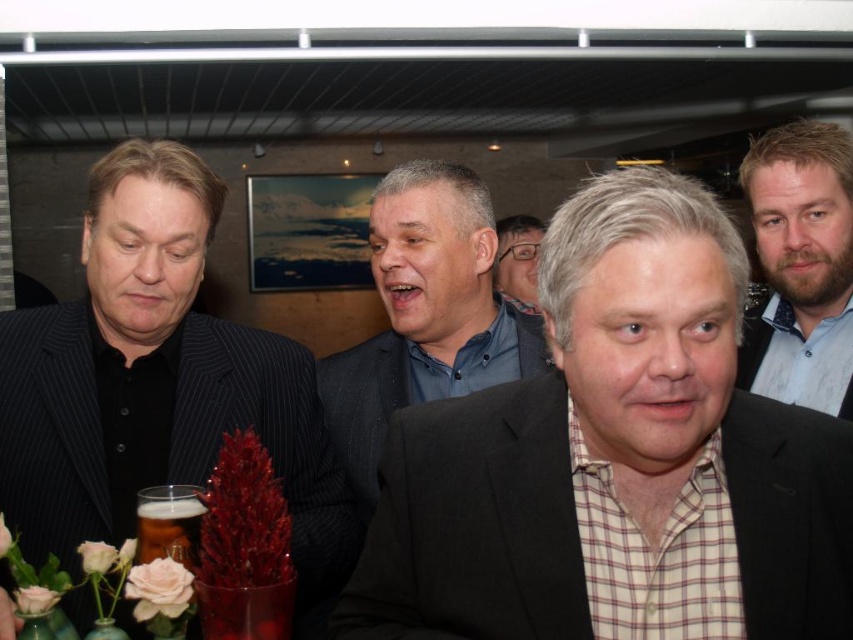
Between plaid cotton shirt at center and black pinstripe suit at left, which one is positioned lower?

plaid cotton shirt at center

Image resolution: width=853 pixels, height=640 pixels. What do you see at coordinates (616, 460) in the screenshot?
I see `plaid cotton shirt at center` at bounding box center [616, 460].

Describe the element at coordinates (616, 460) in the screenshot. This screenshot has height=640, width=853. I see `plaid cotton shirt at center` at that location.

The height and width of the screenshot is (640, 853). I want to click on plaid cotton shirt at center, so pos(616,460).

Which is more to the left, bearded man at center or matte black glasses at center?

matte black glasses at center is more to the left.

Who is more distant from viewer, (799,356) or (543,225)?

The point (543,225) is behind.

Who is more forward, (846, 138) or (509, 216)?

Point (846, 138)

Identify the location of bearded man at center. (801, 266).

Does black pinstripe suit at left appear on the right side of gray matte suit at center?

No, black pinstripe suit at left is not to the right of gray matte suit at center.

Does black pinstripe suit at left appear over gray matte suit at center?

Incorrect, black pinstripe suit at left is not positioned above gray matte suit at center.

Does point (206, 413) lie in front of point (433, 316)?

Yes, point (206, 413) is in front of point (433, 316).

This screenshot has height=640, width=853. What are the coordinates of `black pinstripe suit at left` in the screenshot? It's located at (154, 380).